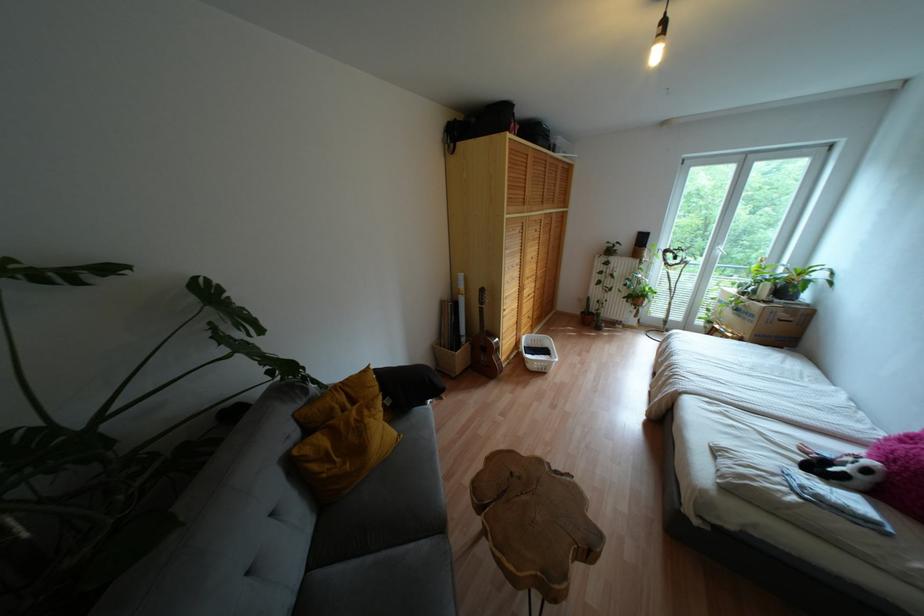
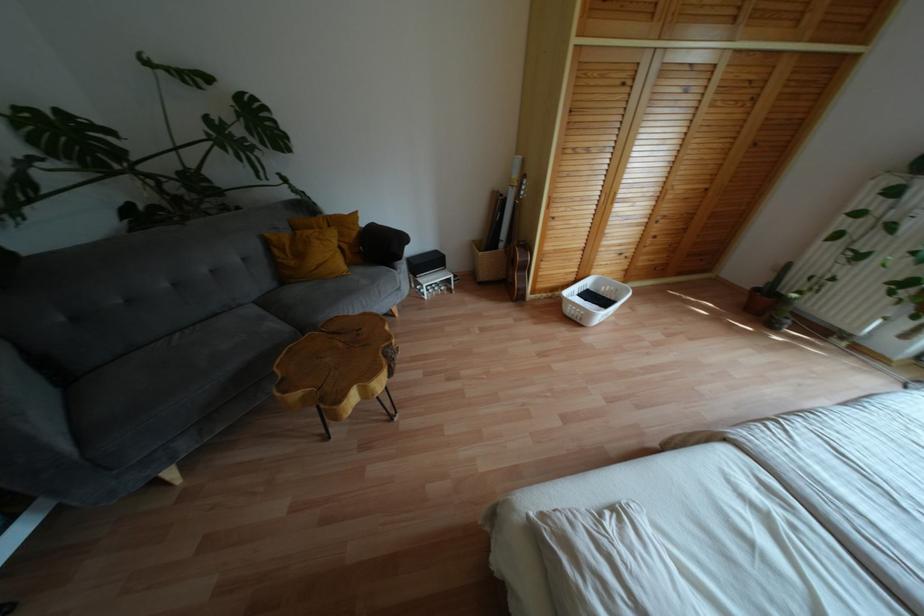
In the second image, find the point that corresponds to [523,498] in the first image.

(341, 344)